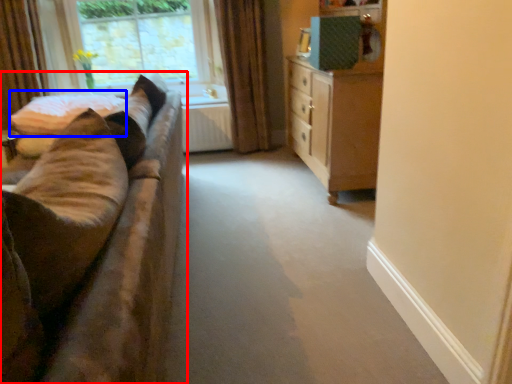
Question: Which object is closer to the camera taking this photo, studio couch (highlighted by a red box) or bedding (highlighted by a blue box)?

Choices:
 (A) studio couch
 (B) bedding

Answer: (A)